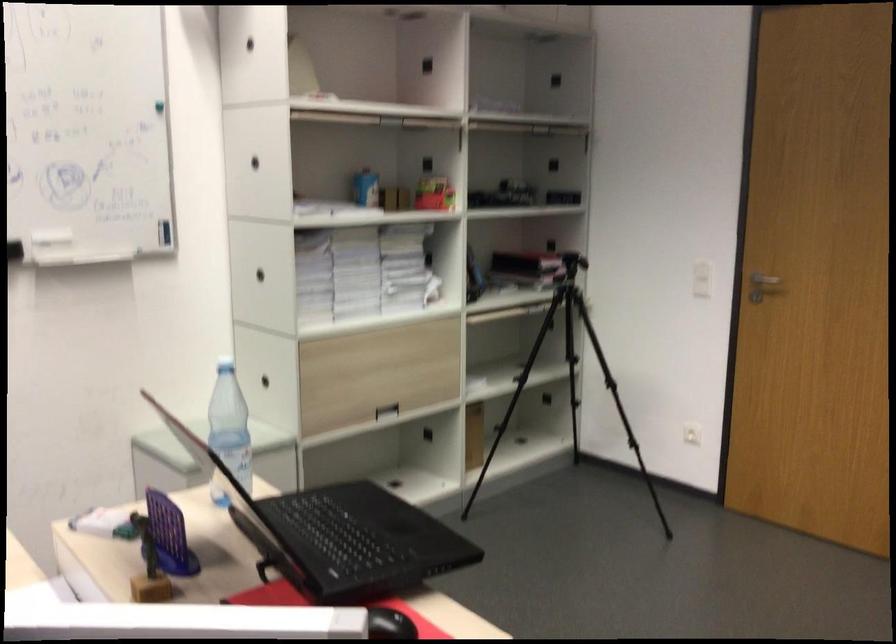
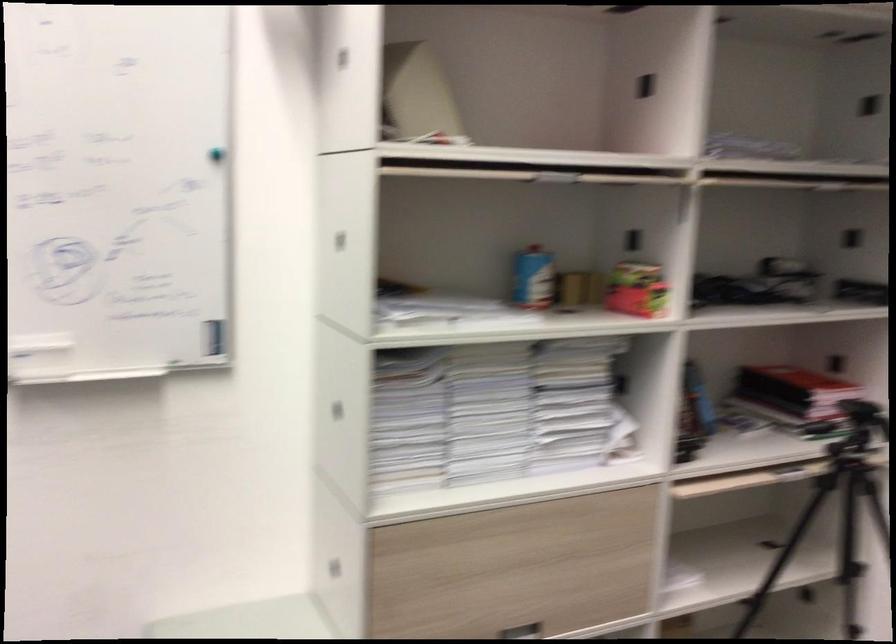
Find the pixel in the second image that matches the point at 371,189 in the first image.

(532, 278)